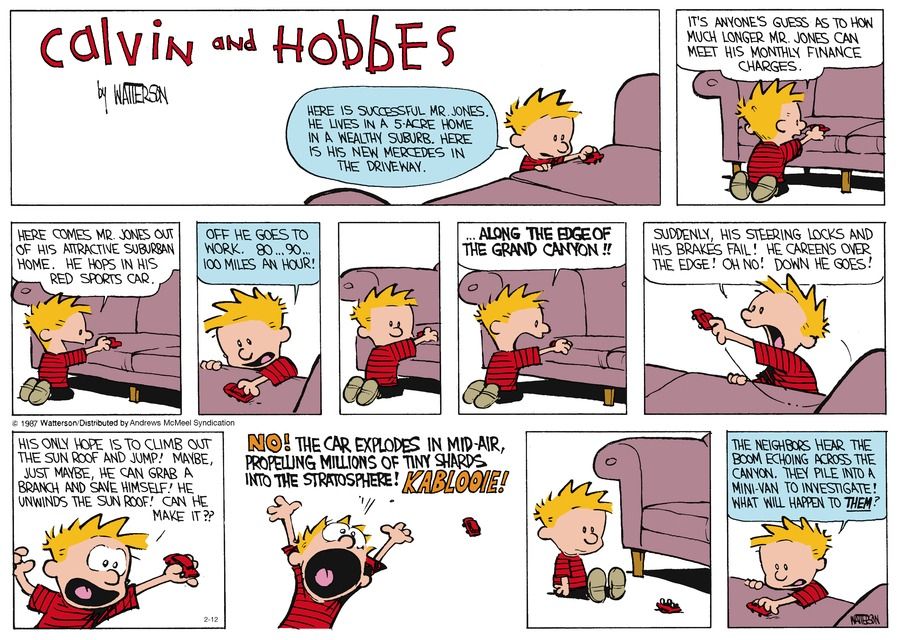
At what (x,y) coordinates should I click in order to perform the action: click on toy car calvin is playing with. Please return your answer as a coordinate pair (x, y). Looking at the image, I should click on (595, 156), (821, 127), (702, 317), (418, 330), (238, 392), (112, 340), (182, 557), (469, 524), (669, 605), (761, 609).